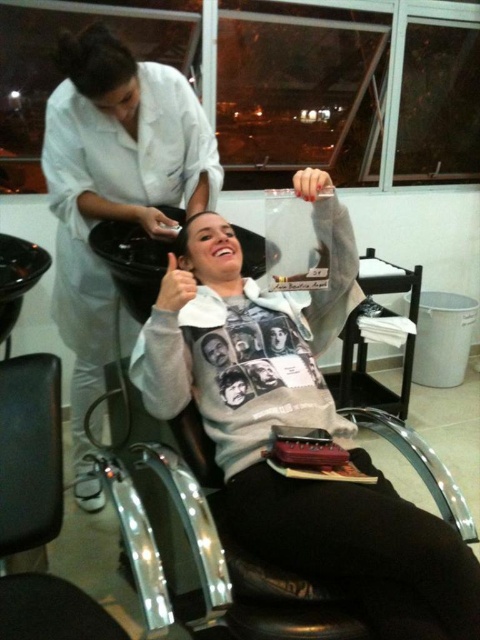
You are a customer in a hair salon and want to place your white matte sweatshirt at center on the nearest available surface. Based on the scene description, where would you place it?

The white matte sweatshirt at center is located at point 2D coordinates (296, 424), so you can place it on the surface nearest to that position.

You are a customer in a hair salon. You see a white matte sweatshirt at center and a white matte hairdresser at upper left. The stylist wants to place a new hairdryer between them. Is there enough space for the hairdryer if it measures 18 inches long?

Result: The white matte sweatshirt at center is 22.63 inches away from the white matte hairdresser at upper left. Since the hairdryer is 18 inches long, there is sufficient space between them to place it.

Consider the image. You are a customer in a hair salon and you see the white matte sweatshirt at center and the white matte hairdresser at upper left. Which one appears to be larger in size?

The white matte hairdresser at upper left is larger than the white matte sweatshirt at center.